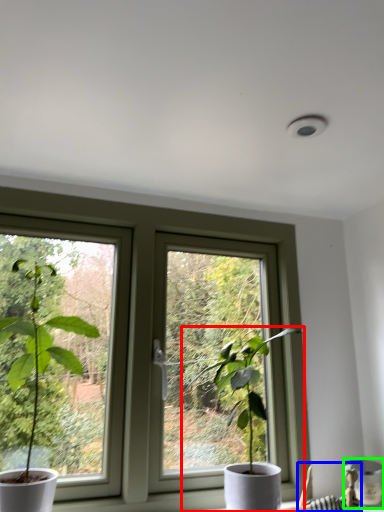
Question: Based on their relative distances, which object is farther from houseplant (highlighted by a red box)? Choose from couple (highlighted by a blue box) and vase (highlighted by a green box).

Choices:
 (A) couple
 (B) vase

Answer: (B)